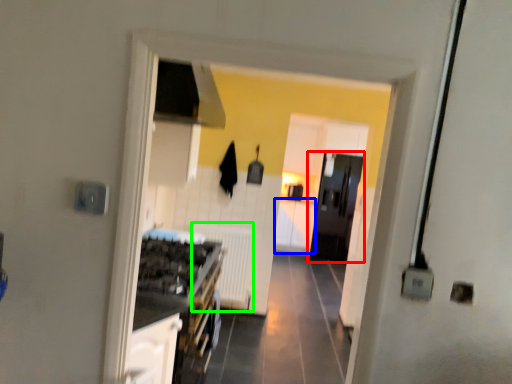
Question: Which object is positioned closest to door (highlighted by a red box)? Select from cabinetry (highlighted by a blue box) and radiator (highlighted by a green box).

Choices:
 (A) cabinetry
 (B) radiator

Answer: (A)